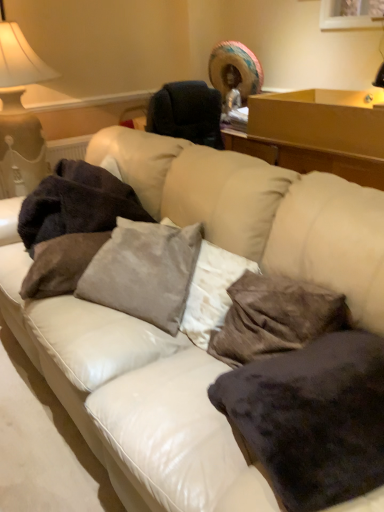
Question: Is dark brown plush blanket at left further to camera compared to velvet gray pillow at center, positioned as the 2th pillow in left-to-right order?

Choices:
 (A) yes
 (B) no

Answer: (A)

Question: From a real-world perspective, is dark brown plush blanket at left below velvet gray pillow at center, which is the third pillow from right to left?

Choices:
 (A) no
 (B) yes

Answer: (A)

Question: From the image's perspective, does dark brown plush blanket at left appear higher than velvet gray pillow at center, which is the third pillow from right to left?

Choices:
 (A) yes
 (B) no

Answer: (A)

Question: From a real-world perspective, is dark brown plush blanket at left physically above velvet gray pillow at center, which is the third pillow from right to left?

Choices:
 (A) no
 (B) yes

Answer: (B)

Question: Is dark brown plush blanket at left shorter than velvet gray pillow at center, positioned as the 2th pillow in left-to-right order?

Choices:
 (A) yes
 (B) no

Answer: (B)

Question: Is velvety dark brown pillow at lower right, which is the fourth pillow in left-to-right order, to the left or to the right of wooden table at upper right in the image?

Choices:
 (A) right
 (B) left

Answer: (B)

Question: Looking at the image, does velvety dark brown pillow at lower right, marked as the 1th pillow in a right-to-left arrangement, seem bigger or smaller compared to wooden table at upper right?

Choices:
 (A) small
 (B) big

Answer: (A)

Question: Is point (349, 433) closer or farther from the camera than point (319, 90)?

Choices:
 (A) closer
 (B) farther

Answer: (A)

Question: From the image's perspective, is velvety dark brown pillow at lower right, marked as the 1th pillow in a right-to-left arrangement, above or below wooden table at upper right?

Choices:
 (A) below
 (B) above

Answer: (A)

Question: Considering the positions of point (182, 263) and point (139, 208), is point (182, 263) closer or farther from the camera than point (139, 208)?

Choices:
 (A) closer
 (B) farther

Answer: (A)

Question: From a real-world perspective, is velvet gray pillow at center, which is the third pillow from right to left, above or below dark brown plush blanket at left?

Choices:
 (A) above
 (B) below

Answer: (B)

Question: From the image's perspective, is velvet gray pillow at center, positioned as the 2th pillow in left-to-right order, above or below dark brown plush blanket at left?

Choices:
 (A) above
 (B) below

Answer: (B)

Question: Considering their positions, is velvet gray pillow at center, positioned as the 2th pillow in left-to-right order, located in front of or behind dark brown plush blanket at left?

Choices:
 (A) behind
 (B) front

Answer: (B)

Question: From a real-world perspective, is velvety dark brown pillow at center, the 3th pillow from the left, physically located above or below matte white lampshade at upper left?

Choices:
 (A) below
 (B) above

Answer: (A)

Question: Looking at their shapes, would you say velvety dark brown pillow at center, the 3th pillow from the left, is wider or thinner than matte white lampshade at upper left?

Choices:
 (A) thin
 (B) wide

Answer: (A)